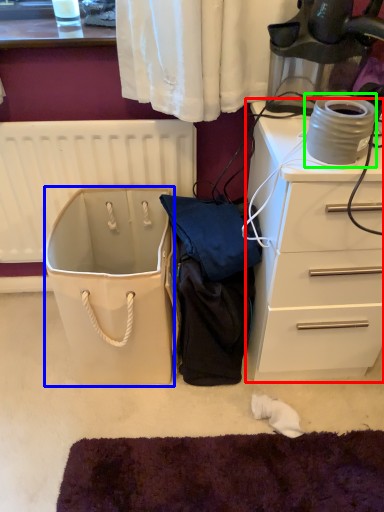
Question: Estimate the real-world distances between objects in this image. Which object is farther from chest of drawers (highlighted by a red box), wide (highlighted by a blue box) or appliance (highlighted by a green box)?

Choices:
 (A) wide
 (B) appliance

Answer: (A)